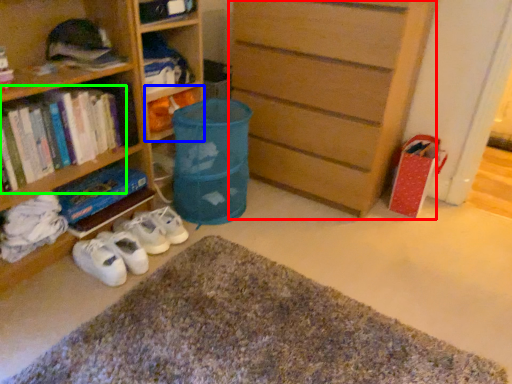
Question: Which object is the farthest from chest of drawers (highlighted by a red box)? Choose among these: book (highlighted by a blue box) or book (highlighted by a green box).

Choices:
 (A) book
 (B) book

Answer: (B)